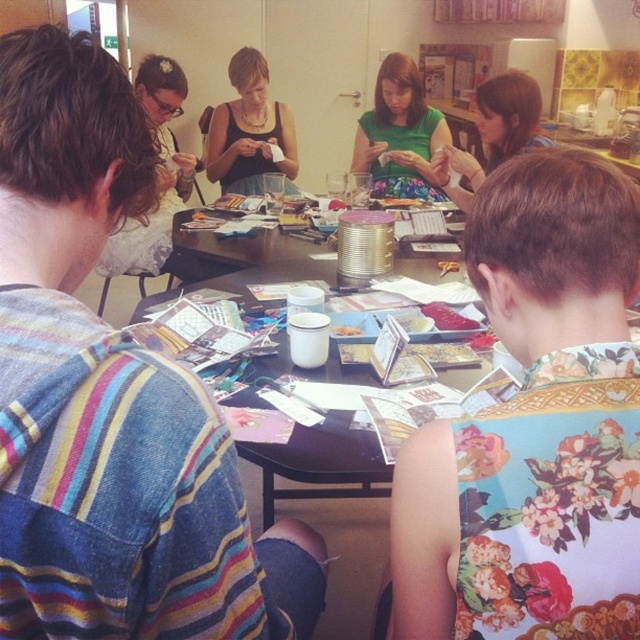
Is point (609, 321) less distant than point (168, 250)?

Yes, point (609, 321) is closer to viewer.

This screenshot has width=640, height=640. I want to click on floral fabric shirt at lower right, so click(534, 426).

Does matte white blouse at upper left appear under green fabric dress at upper center?

Incorrect, matte white blouse at upper left is not positioned below green fabric dress at upper center.

Does matte white blouse at upper left have a greater height compared to green fabric dress at upper center?

Correct, matte white blouse at upper left is much taller as green fabric dress at upper center.

At what (x,y) coordinates should I click in order to perform the action: click on matte white blouse at upper left. Please return your answer as a coordinate pair (x, y). The height and width of the screenshot is (640, 640). Looking at the image, I should click on (160, 176).

Does matte black tank top at center have a smaller size compared to matte white blouse at upper left?

Yes.

Locate an element on the screen. The height and width of the screenshot is (640, 640). matte black tank top at center is located at coordinates (250, 129).